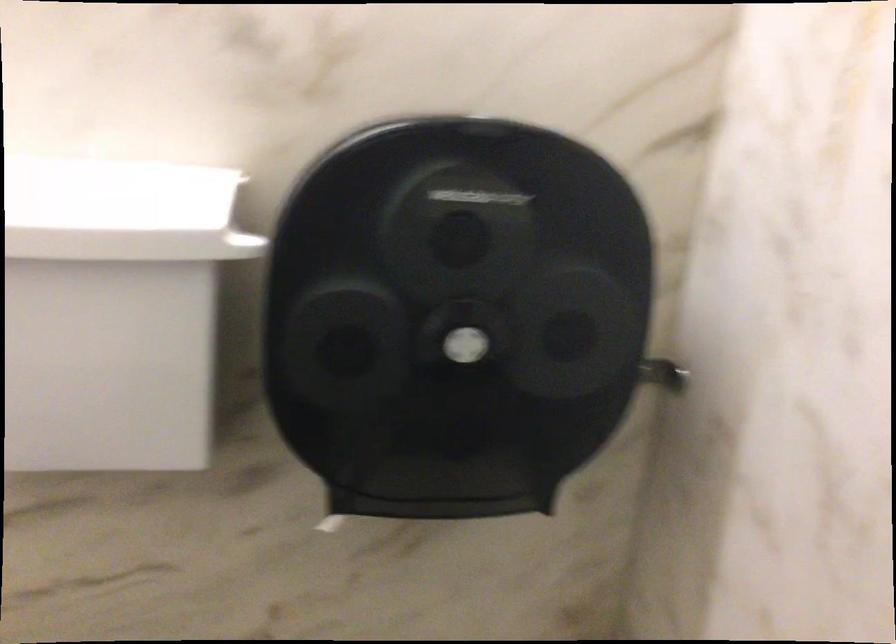
The width and height of the screenshot is (896, 644). Find the location of `dispenser toilet paper`. dispenser toilet paper is located at coordinates (346, 345).